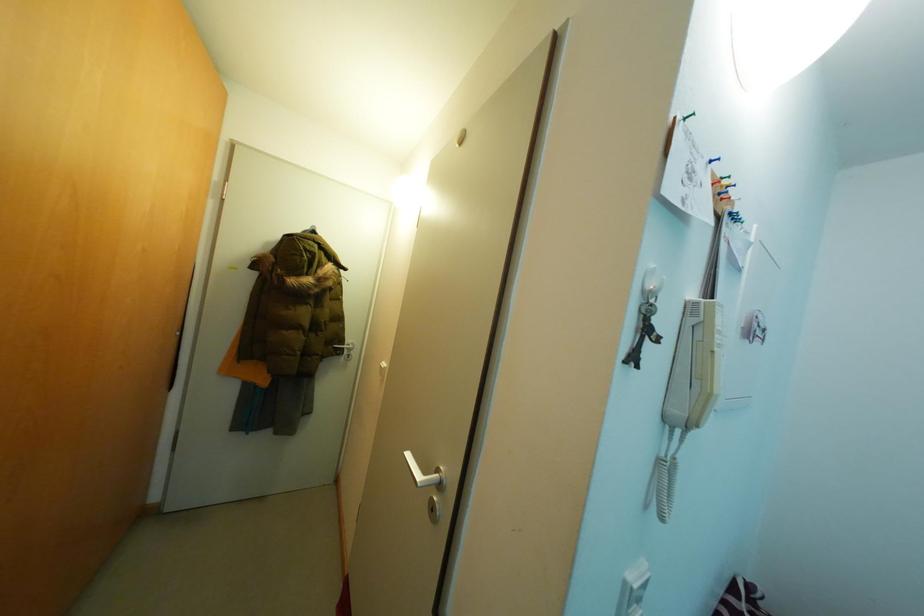
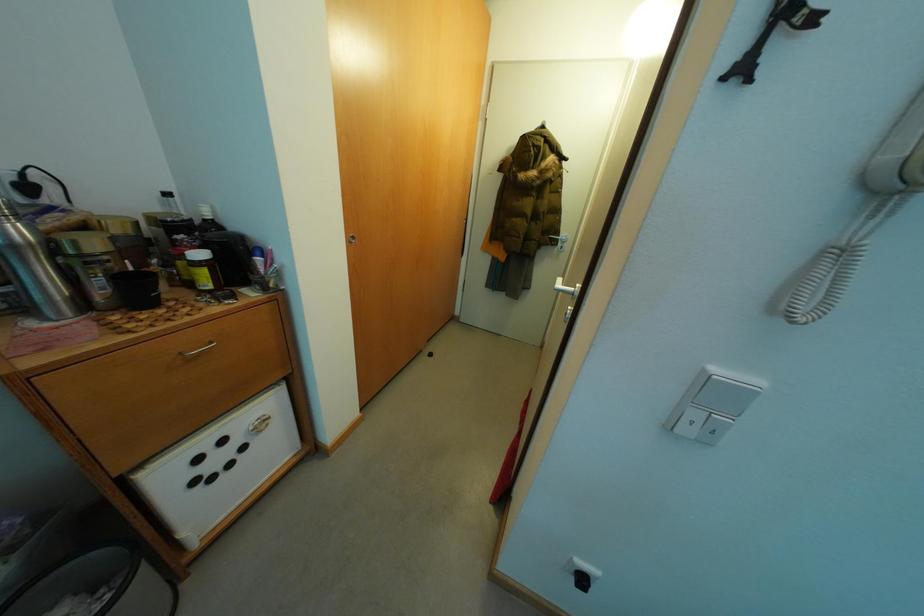
The images are taken continuously from a first-person perspective. In which direction is your viewpoint rotating?

The camera's rotation is toward left-down.